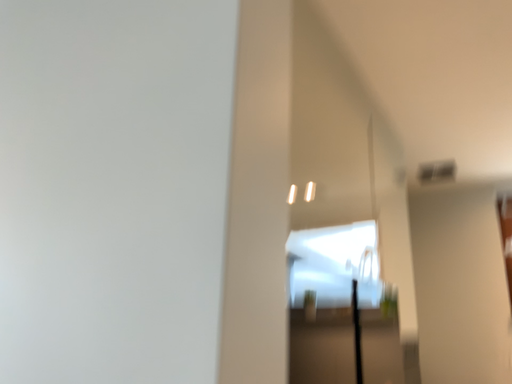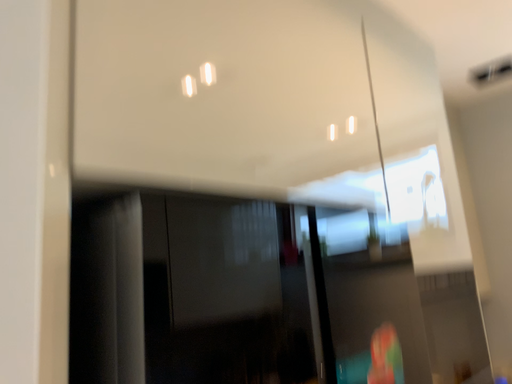
Question: Which way did the camera rotate in the video?

Choices:
 (A) rotated left
 (B) rotated right

Answer: (A)